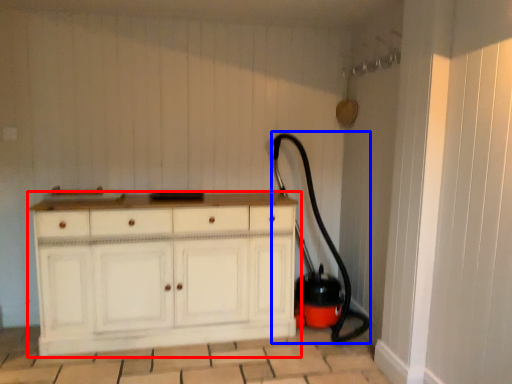
Question: Which object appears farthest to the camera in this image, chest of drawers (highlighted by a red box) or garden hose (highlighted by a blue box)?

Choices:
 (A) chest of drawers
 (B) garden hose

Answer: (B)